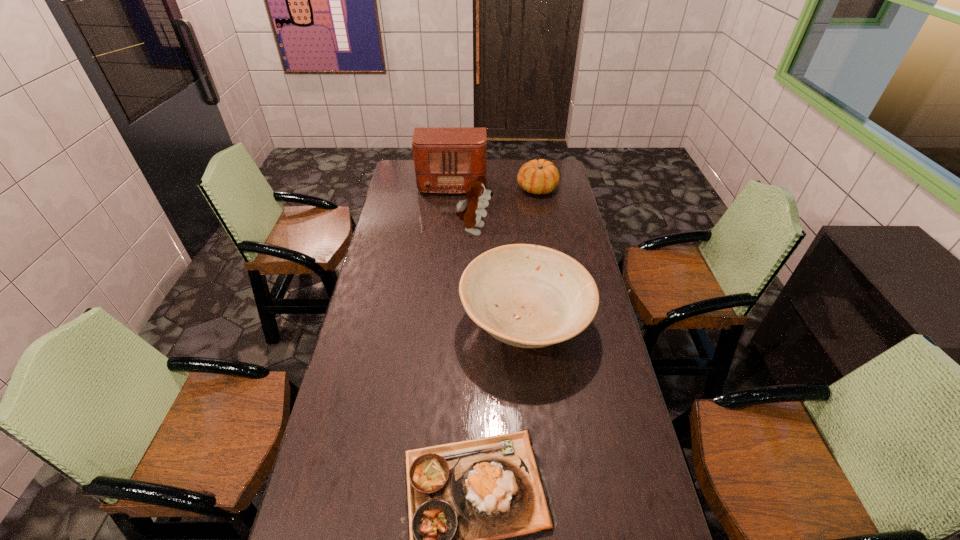
The image size is (960, 540). In order to click on radio receiver in this screenshot , I will do `click(445, 159)`.

Locate an element on the screen. This screenshot has height=540, width=960. the third farthest object is located at coordinates (470, 211).

Find the location of a particular element. This screenshot has height=540, width=960. the fourth farthest object is located at coordinates (529, 296).

Find the location of a particular element. dish is located at coordinates (529, 296).

I want to click on the second shortest object, so click(x=540, y=176).

Identify the location of vacant space located 0.150m on the front panel of the radio receiver. (449, 215).

The width and height of the screenshot is (960, 540). I want to click on free space located 0.350m on the face of the third nearest object, so click(x=570, y=231).

This screenshot has height=540, width=960. I want to click on vacant position located 0.060m on the right of the third tallest object, so click(606, 325).

You are a GUI agent. You are given a task and a screenshot of the screen. Output one action in this format:
    pyautogui.click(x=<x>, y=<y>)
    Task: Click on the free space located 0.270m on the front of the second shortest object
    This screenshot has height=540, width=960.
    Given the screenshot: What is the action you would take?
    pyautogui.click(x=545, y=233)

This screenshot has height=540, width=960. Find the location of `radio receiver at the far edge`. radio receiver at the far edge is located at coordinates (445, 159).